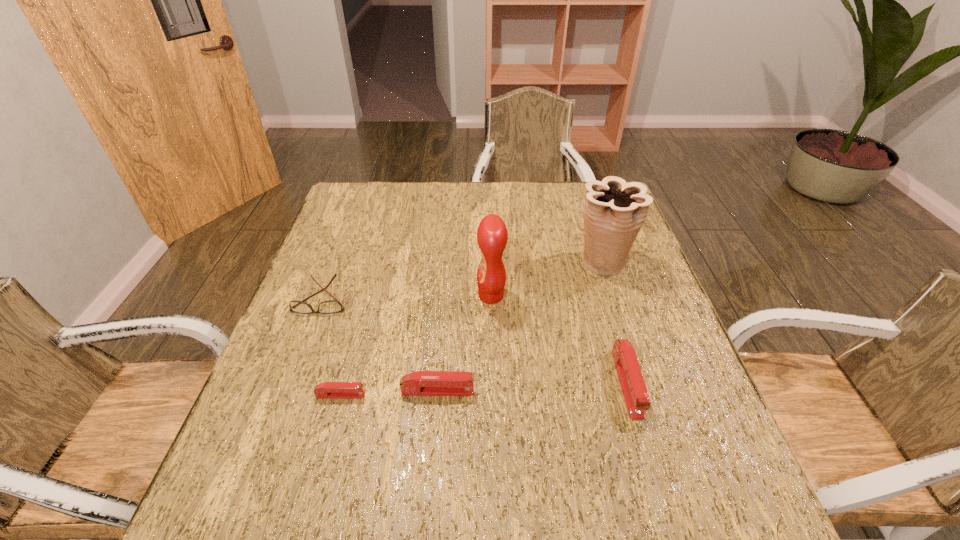
Where is `vacant space at the near edge`? The height and width of the screenshot is (540, 960). vacant space at the near edge is located at coordinates (521, 430).

In the image, there is a desktop. Identify the location of free space at the left edge. The width and height of the screenshot is (960, 540). (330, 271).

Locate an element on the screen. Image resolution: width=960 pixels, height=540 pixels. vacant space at the right edge of the desktop is located at coordinates (628, 316).

Locate an element on the screen. Image resolution: width=960 pixels, height=540 pixels. free point at the far left corner is located at coordinates (358, 198).

Where is `free space at the far right corner of the desktop`? The image size is (960, 540). free space at the far right corner of the desktop is located at coordinates (578, 182).

The height and width of the screenshot is (540, 960). Find the location of `free space between the spectacles and the rightmost stapler`. free space between the spectacles and the rightmost stapler is located at coordinates (474, 341).

Where is `unoccupied position between the rightmost stapler and the fourth object from right to left`? unoccupied position between the rightmost stapler and the fourth object from right to left is located at coordinates (532, 387).

Where is `empty location between the shortest stapler and the condiment`? empty location between the shortest stapler and the condiment is located at coordinates (416, 346).

Identify the location of empty space that is in between the spectacles and the rightmost stapler. The height and width of the screenshot is (540, 960). (474, 341).

Where is `empty location between the shortest stapler and the spectacles`? This screenshot has width=960, height=540. empty location between the shortest stapler and the spectacles is located at coordinates (331, 347).